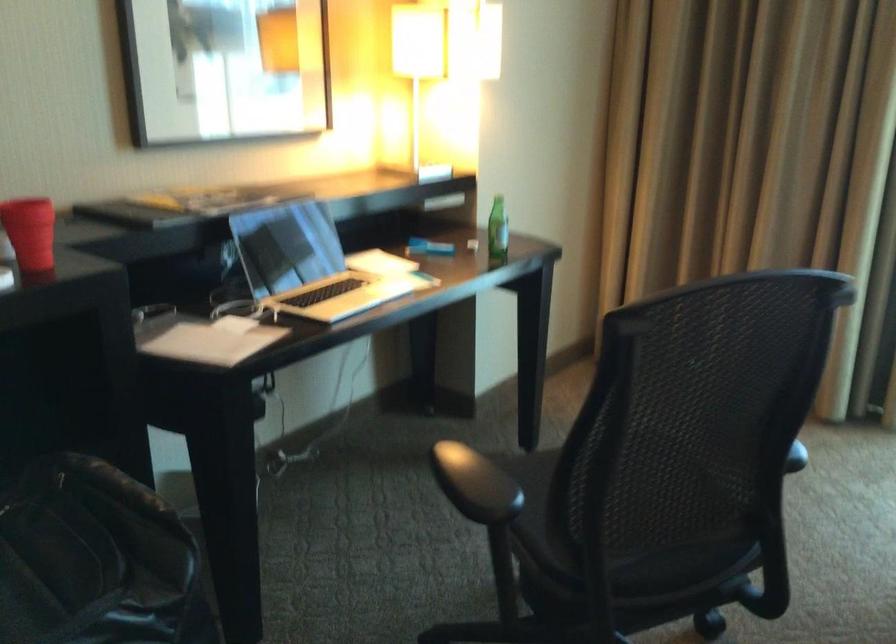
Where is `red plastic cup`? The width and height of the screenshot is (896, 644). red plastic cup is located at coordinates click(30, 232).